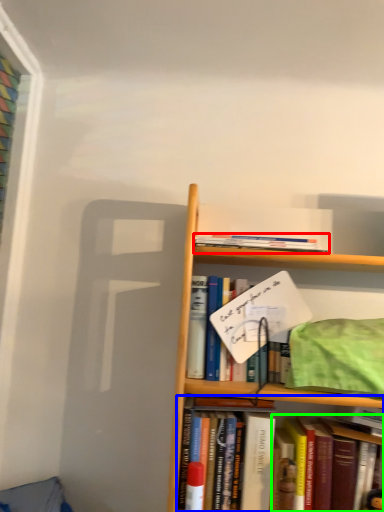
Question: Based on their relative distances, which object is farther from book (highlighted by a red box)? Choose from book (highlighted by a blue box) and book (highlighted by a green box).

Choices:
 (A) book
 (B) book

Answer: (B)